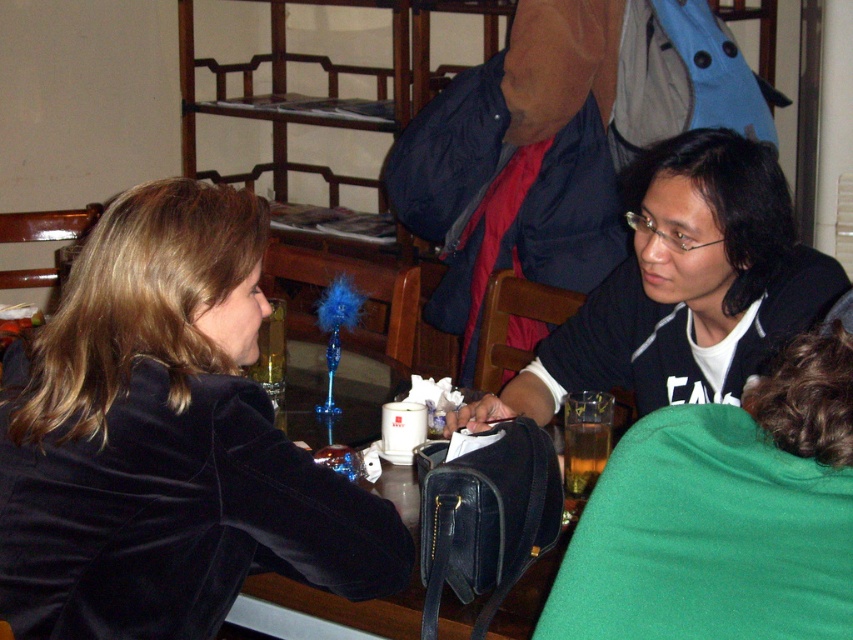
Question: Is velvet black jacket at left bigger than wooden bunk bed at upper center?

Choices:
 (A) no
 (B) yes

Answer: (A)

Question: Does velvet black jacket at left appear under black matte jacket at center?

Choices:
 (A) yes
 (B) no

Answer: (A)

Question: Which point is farther to the camera?

Choices:
 (A) black matte jacket at center
 (B) wooden bunk bed at upper center

Answer: (B)

Question: Which point is farther from the camera taking this photo?

Choices:
 (A) (238, 458)
 (B) (651, 396)

Answer: (B)

Question: Is the position of velvet black jacket at left more distant than that of wooden bunk bed at upper center?

Choices:
 (A) yes
 (B) no

Answer: (B)

Question: Which point is closer to the camera?

Choices:
 (A) wooden bunk bed at upper center
 (B) black matte jacket at center
 (C) velvet black jacket at left

Answer: (C)